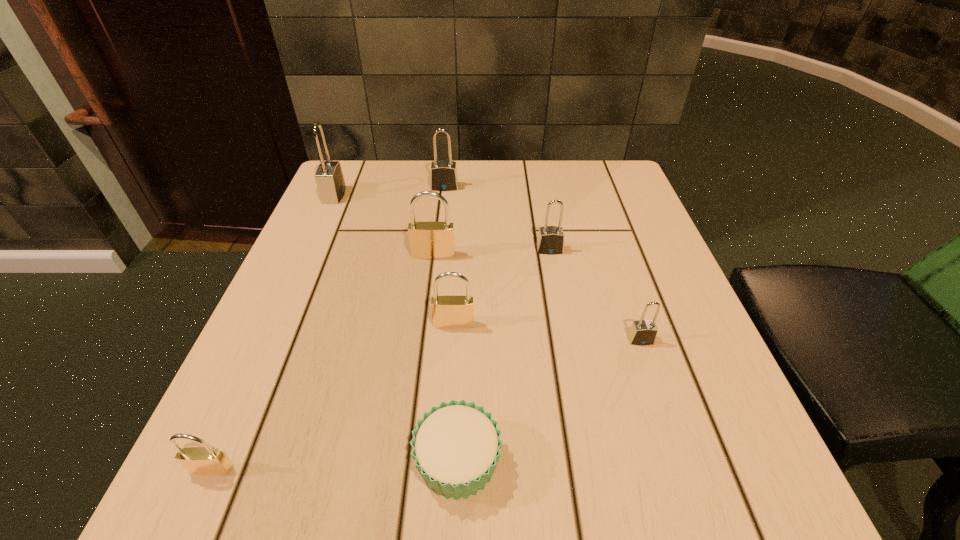
You are a GUI agent. You are given a task and a screenshot of the screen. Output one action in this format:
    pyautogui.click(x=<x>, y=<y>)
    Task: Click on the vacant space that satisfies the following two spatial constraints: 1. on the shackle of the biggest gray padlock; 2. on the right side of the shortest object
    
    Given the screenshot: What is the action you would take?
    pyautogui.click(x=216, y=461)

Locate an element on the screen. free space that satisfies the following two spatial constraints: 1. on the shackle of the second gray padlock from left to right; 2. on the shackle of the tallest object is located at coordinates (444, 195).